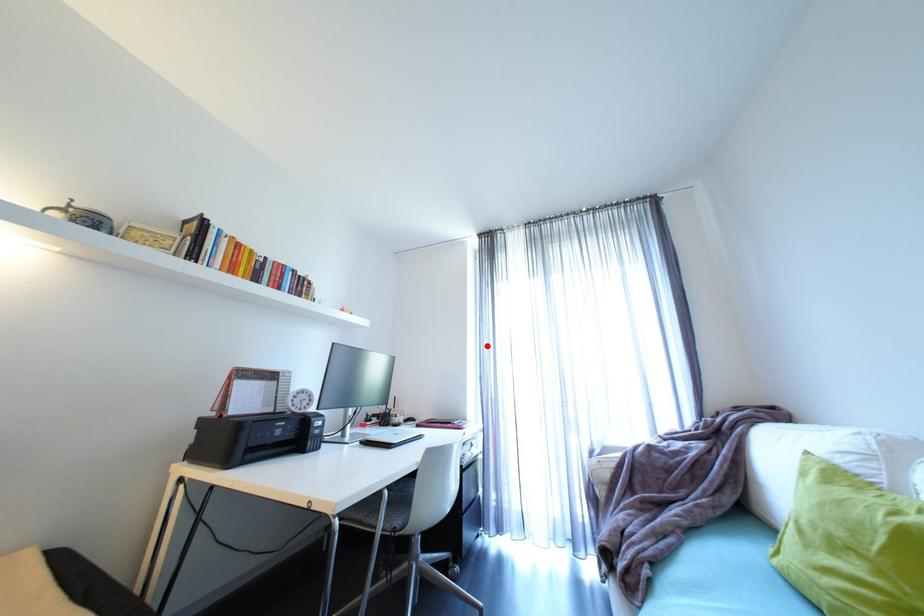
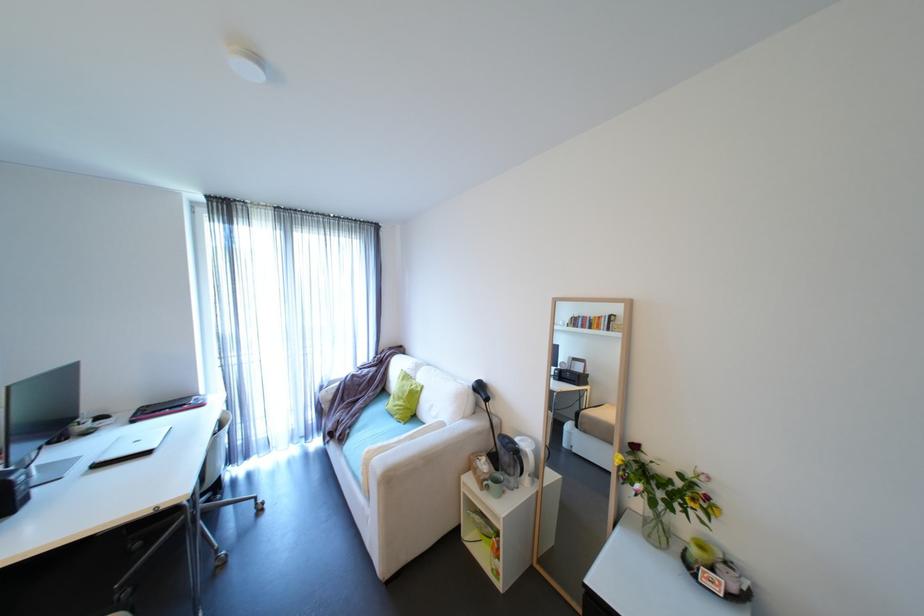
The point at the highlighted location is marked in the first image. Where is the corresponding point in the second image?

(225, 326)